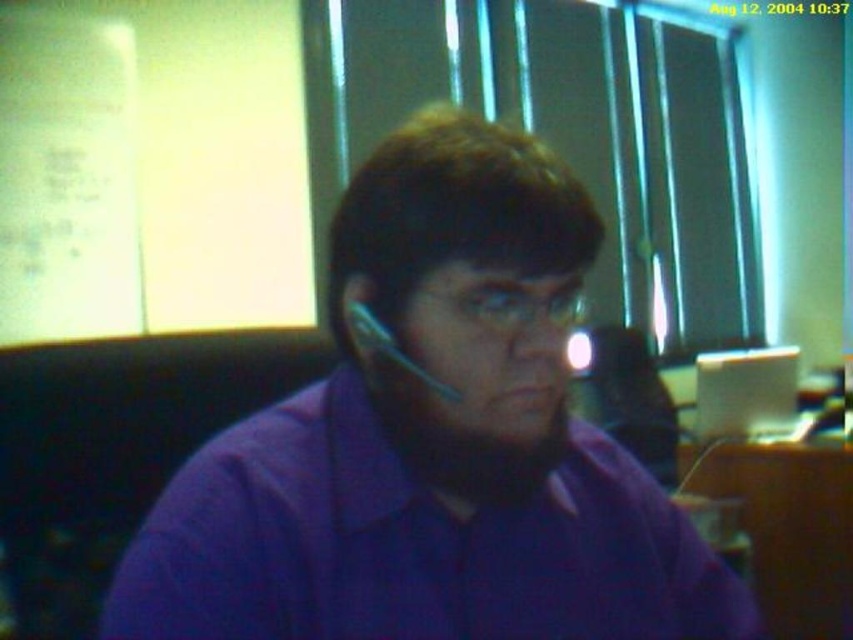
Question: Is purple matte shirt at center closer to the viewer compared to white glossy computer at center?

Choices:
 (A) no
 (B) yes

Answer: (B)

Question: Which point appears farthest from the camera in this image?

Choices:
 (A) pos(328,596)
 (B) pos(769,403)

Answer: (B)

Question: Is wooden desk at lower right thinner than white glossy computer at center?

Choices:
 (A) no
 (B) yes

Answer: (A)

Question: Which point is farther from the camera taking this photo?

Choices:
 (A) (479, 412)
 (B) (850, 520)
 (C) (775, 390)

Answer: (C)

Question: Among these objects, which one is farthest from the camera?

Choices:
 (A) white glossy computer at center
 (B) wooden desk at lower right

Answer: (A)

Question: Considering the relative positions of wooden desk at lower right and white glossy computer at center in the image provided, where is wooden desk at lower right located with respect to white glossy computer at center?

Choices:
 (A) left
 (B) right

Answer: (B)